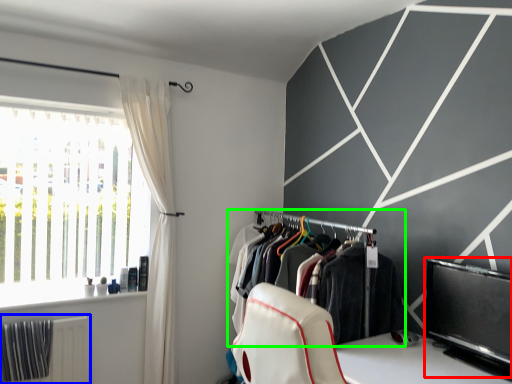
Question: Based on their relative distances, which object is farther from window screen (highlighted by a red box)? Choose from radiator (highlighted by a blue box) and closet (highlighted by a green box).

Choices:
 (A) radiator
 (B) closet

Answer: (A)